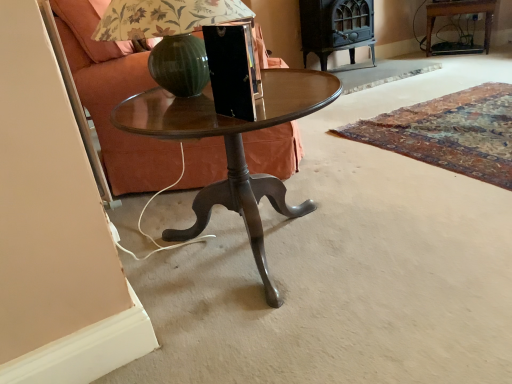
The width and height of the screenshot is (512, 384). In order to click on blank space situated above wooden glossy table at center (from a real-world perspective) in this screenshot , I will do `click(263, 90)`.